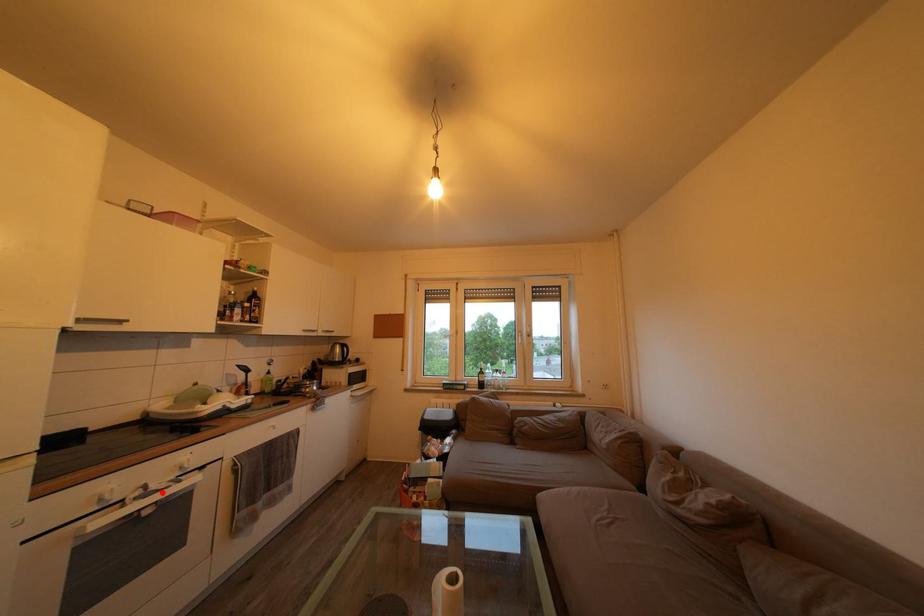
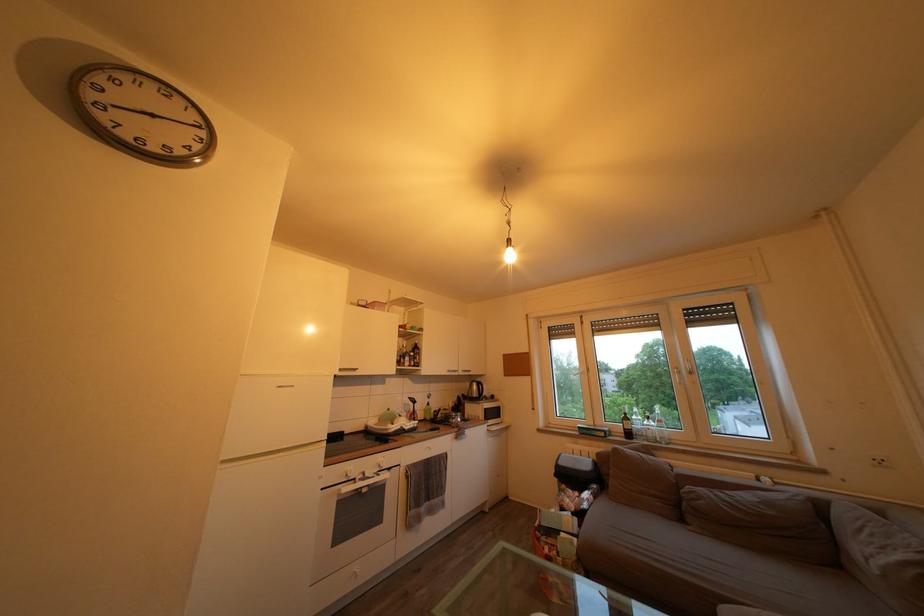
Locate, in the second image, the point that corresponds to the highlighted location in the first image.

(375, 480)